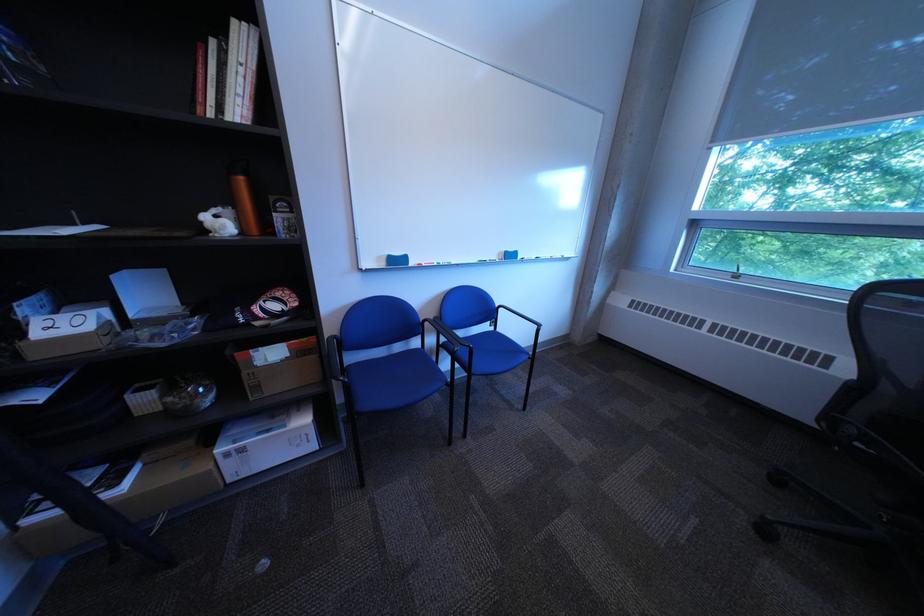
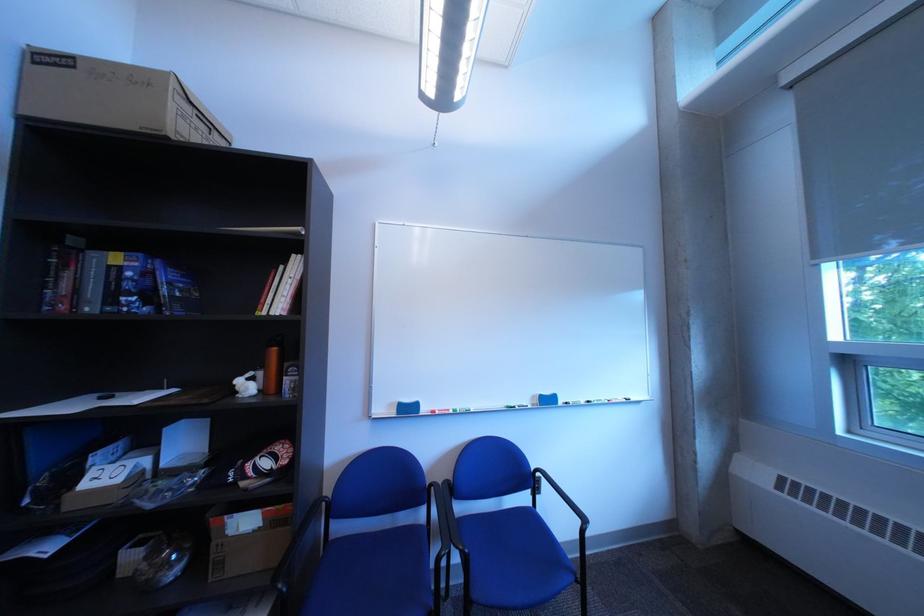
In the second image, find the point that corresponds to point 360,367 in the first image.

(346, 541)